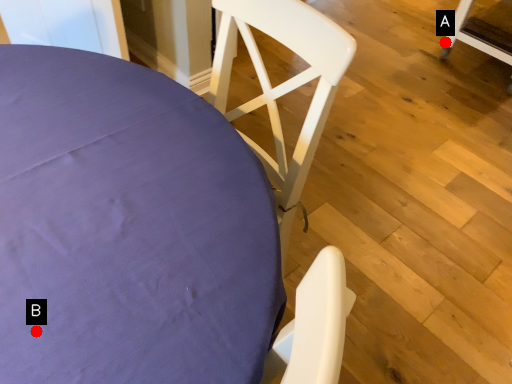
Question: Two points are circled on the image, labeled by A and B beside each circle. Which point is closer to the camera?

Choices:
 (A) A is closer
 (B) B is closer

Answer: (B)